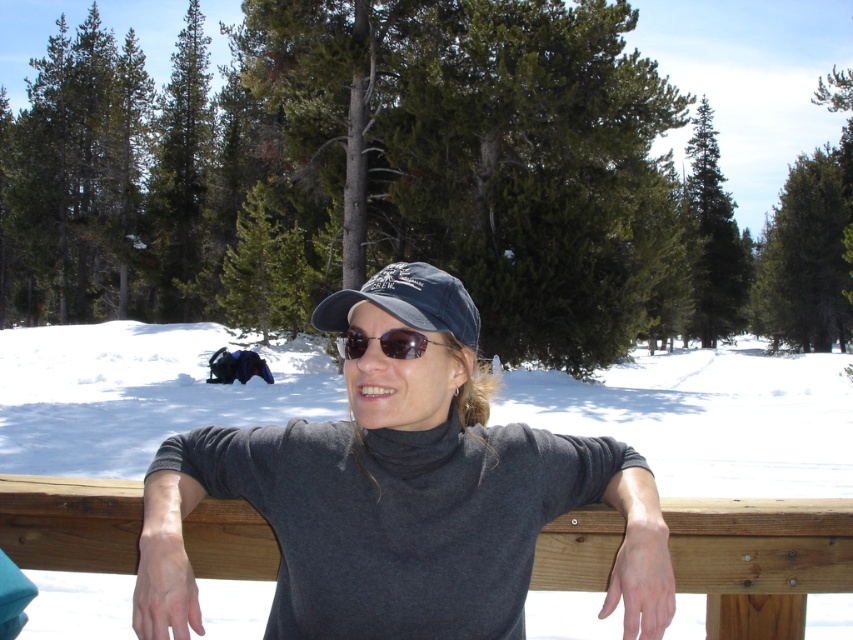
Question: Can you confirm if brown wooden rail at center is bigger than sunglasses at center?

Choices:
 (A) yes
 (B) no

Answer: (A)

Question: In this image, where is gray matte turtleneck at center located relative to brown wooden rail at center?

Choices:
 (A) below
 (B) above

Answer: (B)

Question: Which point is farther to the camera?

Choices:
 (A) (817, 529)
 (B) (451, 282)
 (C) (447, 346)

Answer: (A)

Question: Does gray matte turtleneck at center have a greater width compared to dark blue fabric cap at center?

Choices:
 (A) yes
 (B) no

Answer: (A)

Question: Which of these objects is positioned closest to the brown wooden rail at center?

Choices:
 (A) sunglasses at center
 (B) dark blue fabric cap at center
 (C) gray matte turtleneck at center

Answer: (C)

Question: Which point is closer to the camera?

Choices:
 (A) dark blue fabric cap at center
 (B) sunglasses at center

Answer: (A)